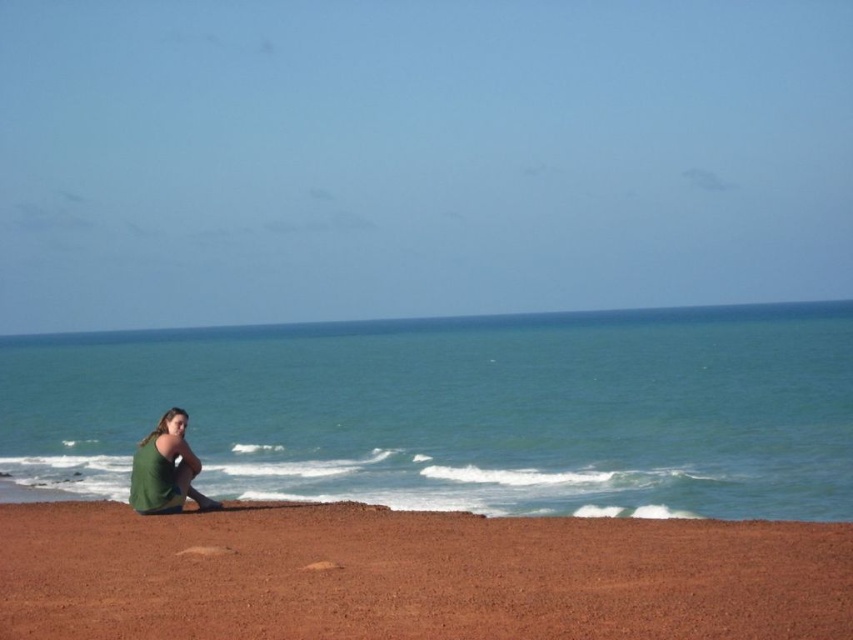
You are a photographer planning to take a photo of the green water at center and the green fabric at lower left. Which object should you focus on first if you want both to be in sharp focus?

The green fabric at lower left is behind the green water at center, so you should focus on the green water at center first to ensure both are in sharp focus.

You are standing on the beach and see two points marked in the image. Which point is closer to you, point [233,332] or point [399,550]?

Point [399,550] is closer to you because it is less further to the camera than point [233,332].